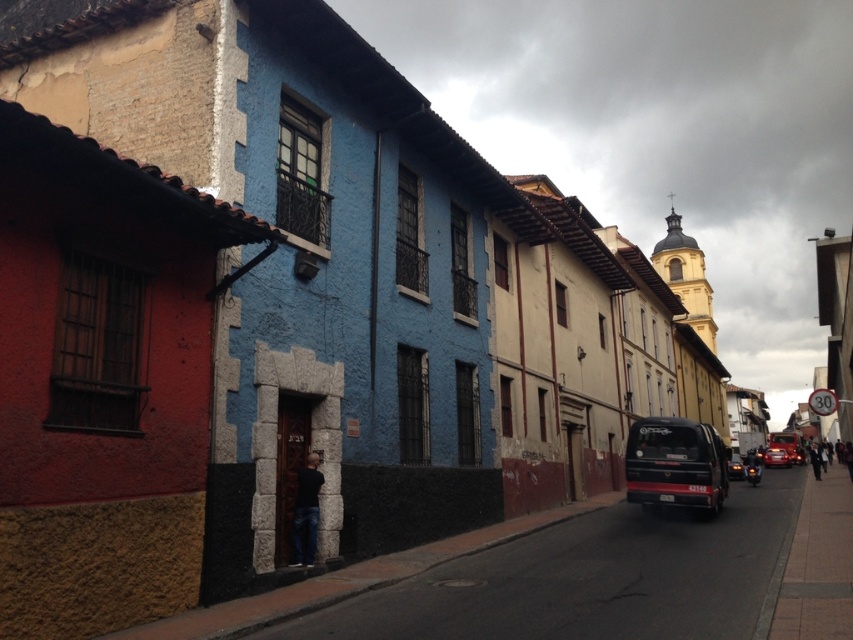
Question: Can you confirm if black matte van at center is thinner than shiny black car at center-right?

Choices:
 (A) no
 (B) yes

Answer: (B)

Question: Which of the following is the farthest from the observer?

Choices:
 (A) brick sidewalk at lower right
 (B) shiny black car at right

Answer: (B)

Question: Is brick sidewalk at lower right to the right of shiny black car at right from the viewer's perspective?

Choices:
 (A) yes
 (B) no

Answer: (B)

Question: Which of the following is the farthest from the observer?

Choices:
 (A) (828, 504)
 (B) (751, 461)
 (C) (785, 449)

Answer: (C)

Question: Among these objects, which one is farthest from the camera?

Choices:
 (A) shiny red car at right
 (B) shiny black car at right
 (C) black matte van at center
 (D) brick sidewalk at lower right

Answer: (A)

Question: Is the position of shiny red car at right less distant than that of shiny black car at right?

Choices:
 (A) yes
 (B) no

Answer: (B)